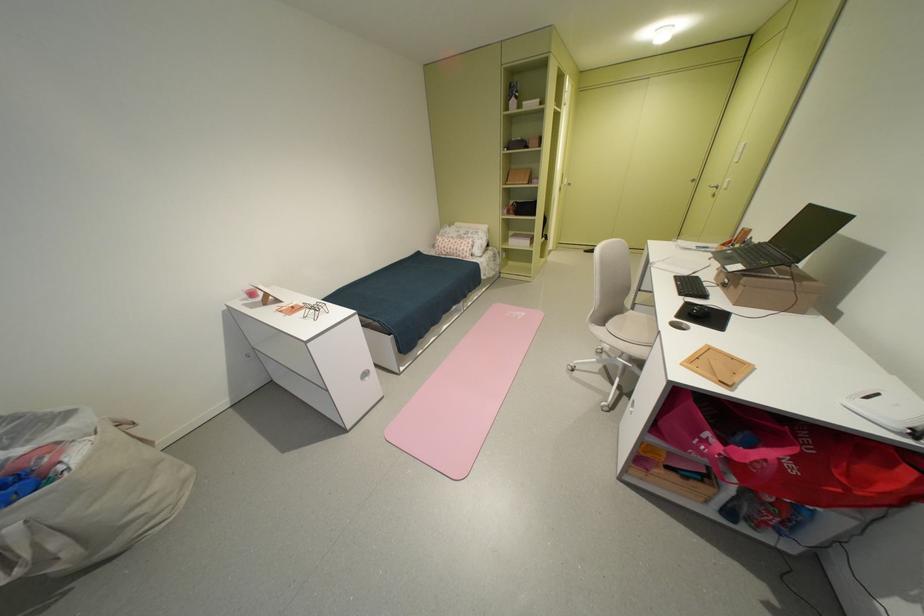
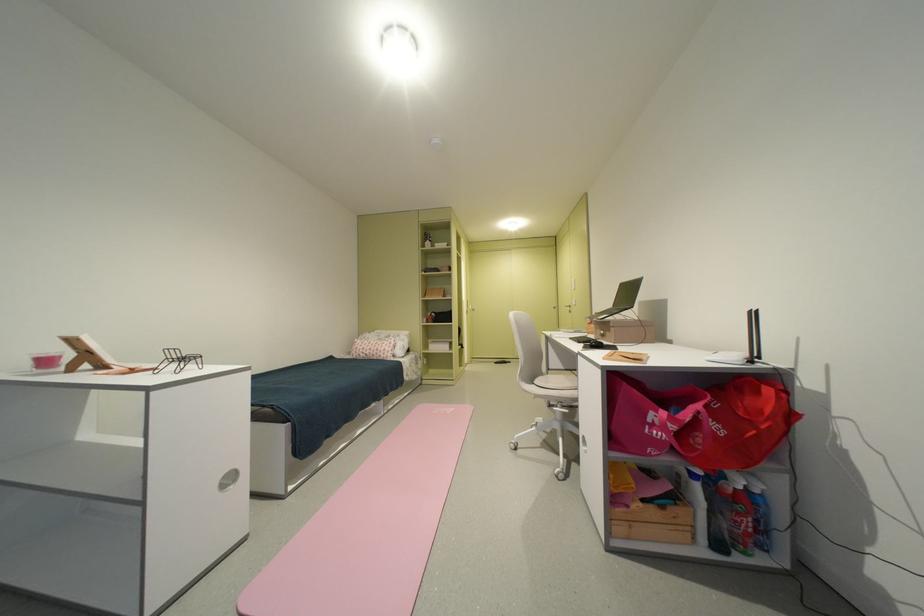
Find the pixel in the second image that matches (x=746, y=288) in the first image.

(618, 331)